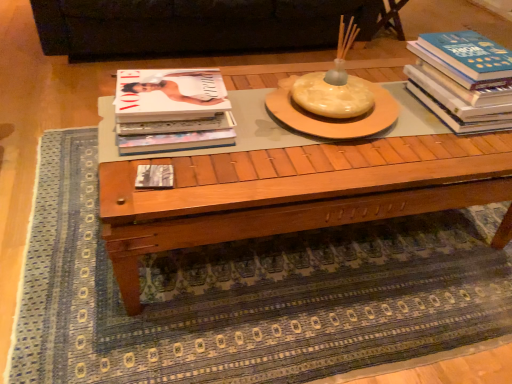
In order to click on free space above matte white magazine at left, which is the 2th book in left-to-right order (from a real-world perspective) in this screenshot , I will do `click(170, 89)`.